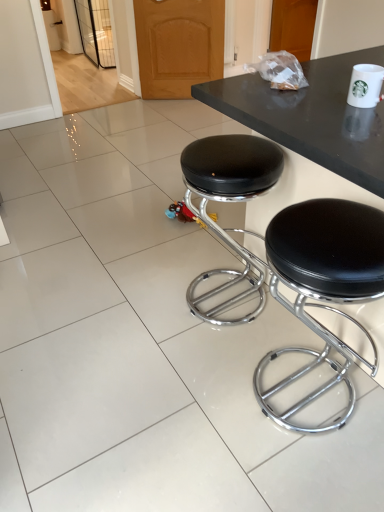
Question: From the image's perspective, does black leather stool at center, acting as the second stool starting from the right, appear lower than black leather stool at center, which is the first stool from right to left?

Choices:
 (A) yes
 (B) no

Answer: (B)

Question: Does black leather stool at center, acting as the second stool starting from the right, have a greater height compared to black leather stool at center, positioned as the second stool in left-to-right order?

Choices:
 (A) yes
 (B) no

Answer: (A)

Question: Is black leather stool at center, placed as the 1th stool when sorted from left to right, to the right of black leather stool at center, positioned as the second stool in left-to-right order, from the viewer's perspective?

Choices:
 (A) no
 (B) yes

Answer: (A)

Question: Is black leather stool at center, placed as the 1th stool when sorted from left to right, further to the viewer compared to black leather stool at center, which is the first stool from right to left?

Choices:
 (A) no
 (B) yes

Answer: (B)

Question: Considering the relative sizes of black leather stool at center, placed as the 1th stool when sorted from left to right, and black leather stool at center, which is the first stool from right to left, in the image provided, is black leather stool at center, placed as the 1th stool when sorted from left to right, bigger than black leather stool at center, which is the first stool from right to left,?

Choices:
 (A) no
 (B) yes

Answer: (B)

Question: Considering the positions of black leather stool at center, which is the first stool from right to left, and white ceramic mug at upper right in the image, is black leather stool at center, which is the first stool from right to left, taller or shorter than white ceramic mug at upper right?

Choices:
 (A) tall
 (B) short

Answer: (A)

Question: In the image, is black leather stool at center, which is the first stool from right to left, positioned in front of or behind white ceramic mug at upper right?

Choices:
 (A) behind
 (B) front

Answer: (B)

Question: Visually, is black leather stool at center, positioned as the second stool in left-to-right order, positioned to the left or to the right of white ceramic mug at upper right?

Choices:
 (A) left
 (B) right

Answer: (A)

Question: From a real-world perspective, is black leather stool at center, positioned as the second stool in left-to-right order, positioned above or below white ceramic mug at upper right?

Choices:
 (A) below
 (B) above

Answer: (A)

Question: In the image, is white ceramic mug at upper right positioned in front of or behind black leather stool at center, placed as the 1th stool when sorted from left to right?

Choices:
 (A) behind
 (B) front

Answer: (B)

Question: Does point (347, 95) appear closer or farther from the camera than point (226, 269)?

Choices:
 (A) closer
 (B) farther

Answer: (A)

Question: From the image's perspective, relative to black leather stool at center, acting as the second stool starting from the right, is white ceramic mug at upper right above or below?

Choices:
 (A) below
 (B) above

Answer: (B)

Question: From their relative heights in the image, would you say white ceramic mug at upper right is taller or shorter than black leather stool at center, placed as the 1th stool when sorted from left to right?

Choices:
 (A) tall
 (B) short

Answer: (B)

Question: Based on their positions, is black leather stool at center, placed as the 1th stool when sorted from left to right, located to the left or right of white ceramic mug at upper right?

Choices:
 (A) right
 (B) left

Answer: (B)

Question: Considering the positions of point (264, 148) and point (354, 90), is point (264, 148) closer or farther from the camera than point (354, 90)?

Choices:
 (A) farther
 (B) closer

Answer: (A)